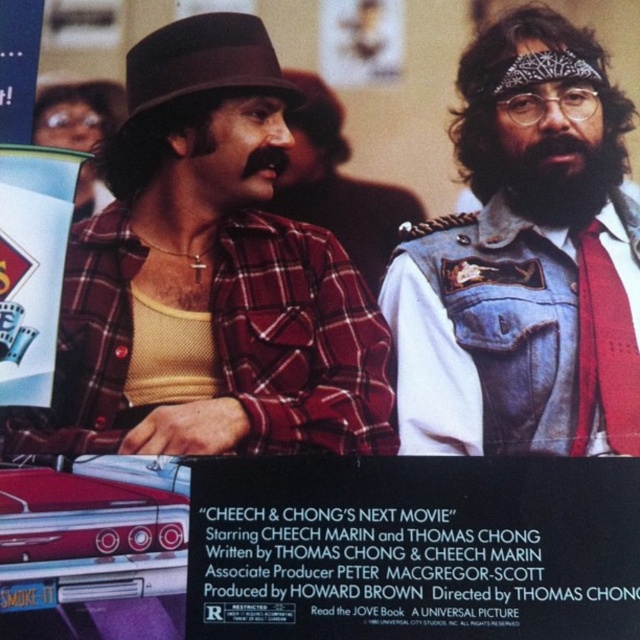
Which of these two, denim vest at right or black paper at lower center, stands shorter?

With less height is black paper at lower center.

From the picture: Which is more to the left, denim vest at right or black paper at lower center?

black paper at lower center is more to the left.

What do you see at coordinates (525, 259) in the screenshot?
I see `denim vest at right` at bounding box center [525, 259].

Find the location of `denim vest at right`. denim vest at right is located at coordinates (525, 259).

Locate an element on the screen. plaid shirt at left is located at coordinates (209, 278).

Locate an element on the screen. plaid shirt at left is located at coordinates (209, 278).

Is point (253, 49) more distant than point (316, 513)?

Yes, point (253, 49) is farther from viewer.

Where is `plaid shirt at left`? The width and height of the screenshot is (640, 640). plaid shirt at left is located at coordinates (209, 278).